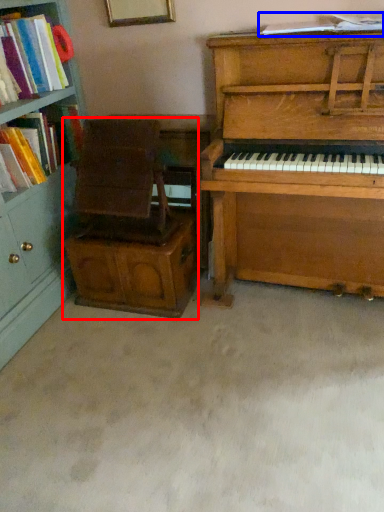
Question: Which of the following is the closest to the observer, armchair (highlighted by a red box) or book (highlighted by a blue box)?

Choices:
 (A) armchair
 (B) book

Answer: (B)